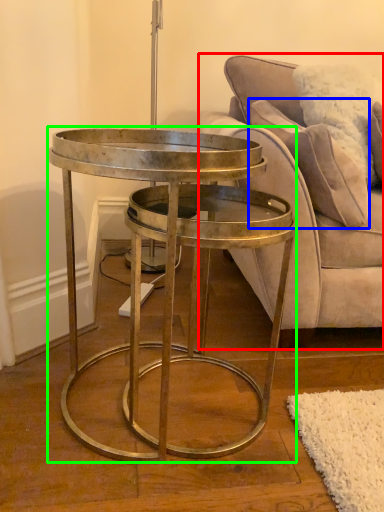
Question: Which object is the closest to the studio couch (highlighted by a red box)? Choose among these: pillow (highlighted by a blue box) or coffee table (highlighted by a green box).

Choices:
 (A) pillow
 (B) coffee table

Answer: (A)